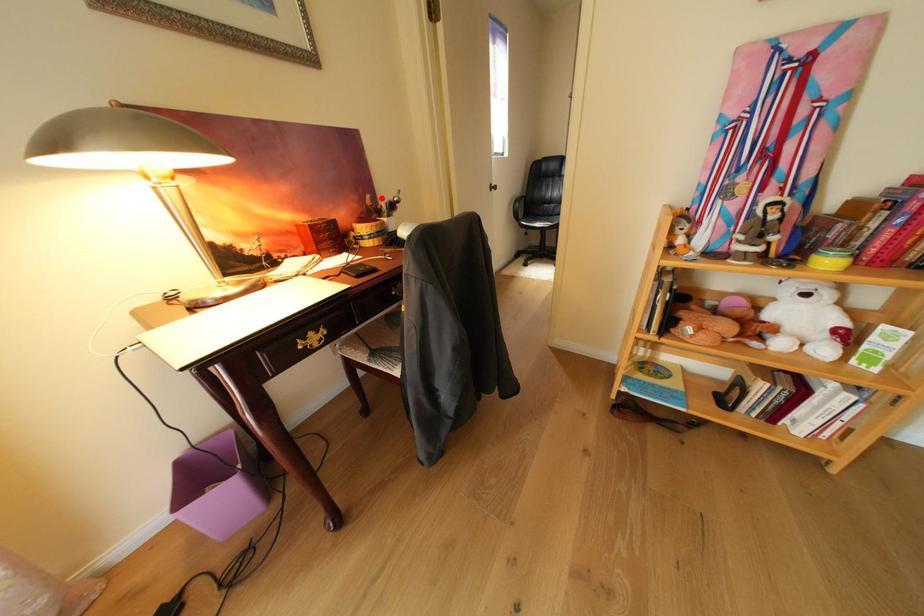
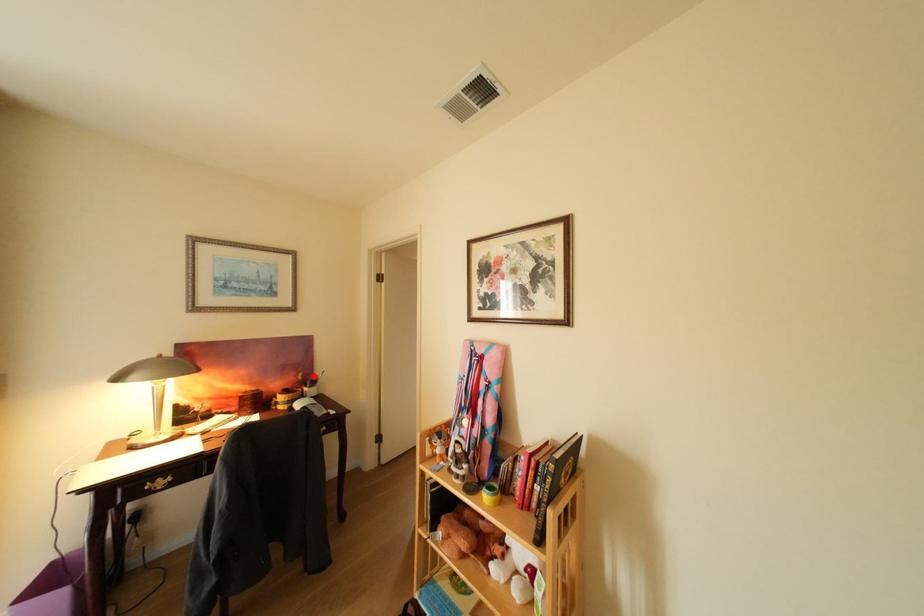
I am providing you with two images of the same scene from different viewpoints. A red point is marked on the first image and another point is marked on the second image. Are the points marked in image1 and image2 representing the same 3D position?

Yes